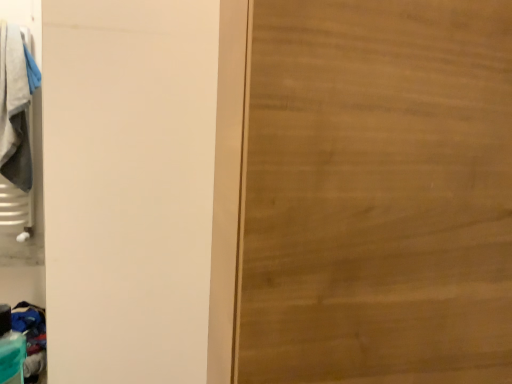
This screenshot has height=384, width=512. Describe the element at coordinates (378, 193) in the screenshot. I see `wooden door at right` at that location.

Find the location of a particular element. This screenshot has height=384, width=512. wooden door at right is located at coordinates (378, 193).

Locate an element on the screen. The image size is (512, 384). wooden door at right is located at coordinates (378, 193).